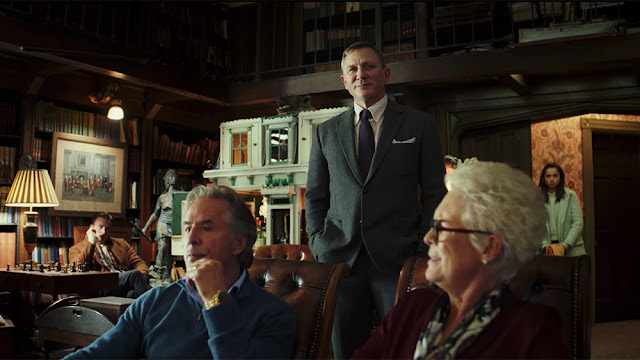
Where is `wallpaper`? This screenshot has width=640, height=360. wallpaper is located at coordinates (576, 149), (544, 139), (572, 168).